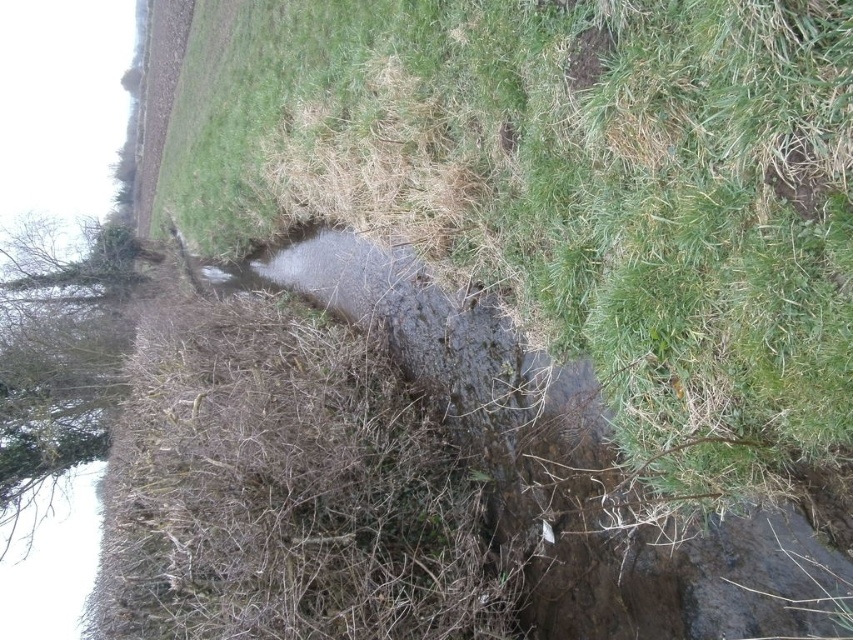
You are standing at the edge of the waterway and want to cross to the other side. You see the green grassy at center in the scene. Based on its location, which direction should you walk to reach it?

The green grassy at center is located at point (569, 192), so you should walk towards the center of the scene to reach it.